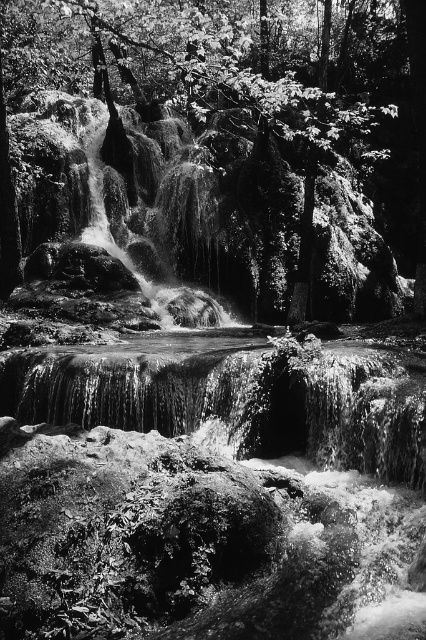
Consider the image. Who is lower down, translucent water at center or smooth bark tree at upper center?

translucent water at center is below.

Is translucent water at center further to the viewer compared to smooth bark tree at upper center?

No, it is not.

What do you see at coordinates (210, 492) in the screenshot?
I see `translucent water at center` at bounding box center [210, 492].

Find the location of a particular element. translucent water at center is located at coordinates (210, 492).